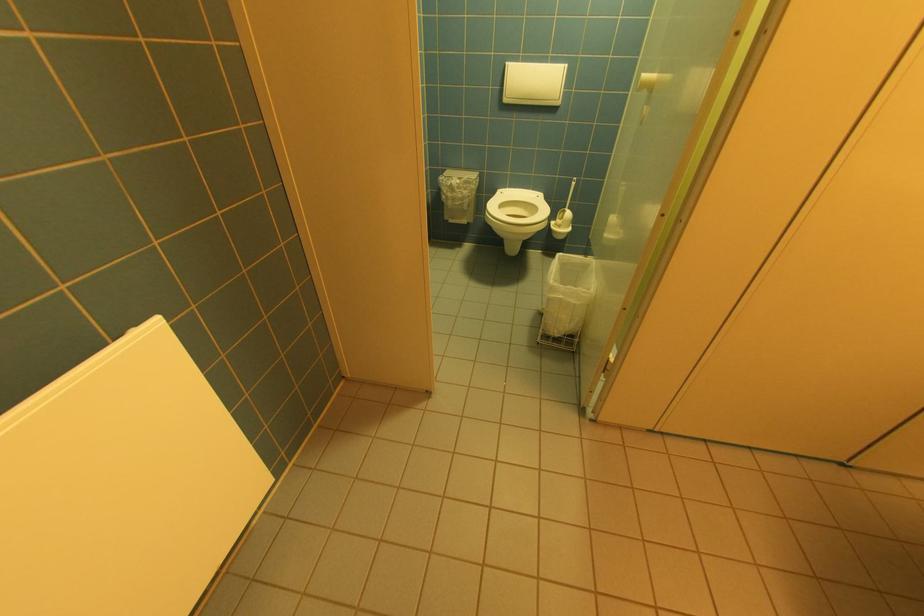
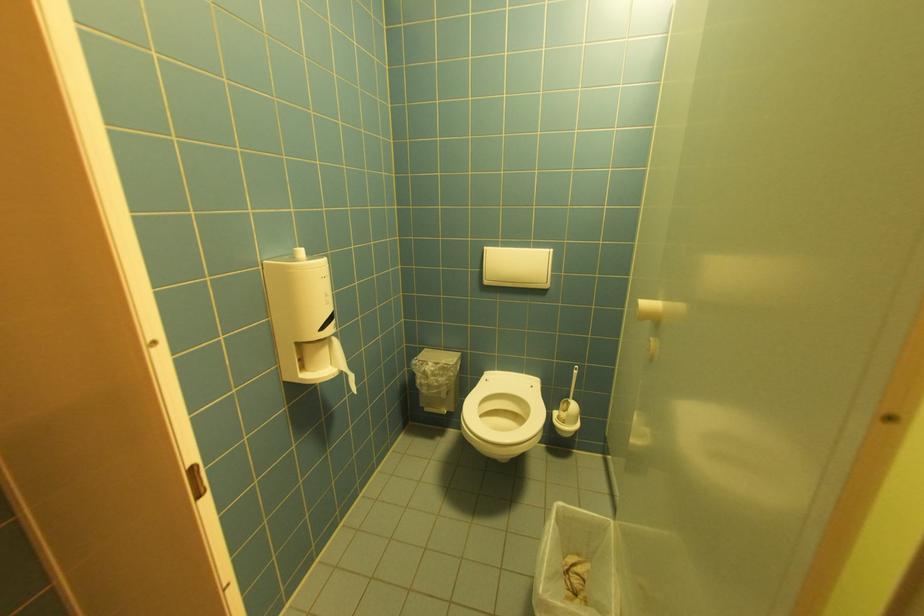
Consider the image. In a continuous first-person perspective shot, in which direction is the camera moving?

The cameraman moved toward right, forward.